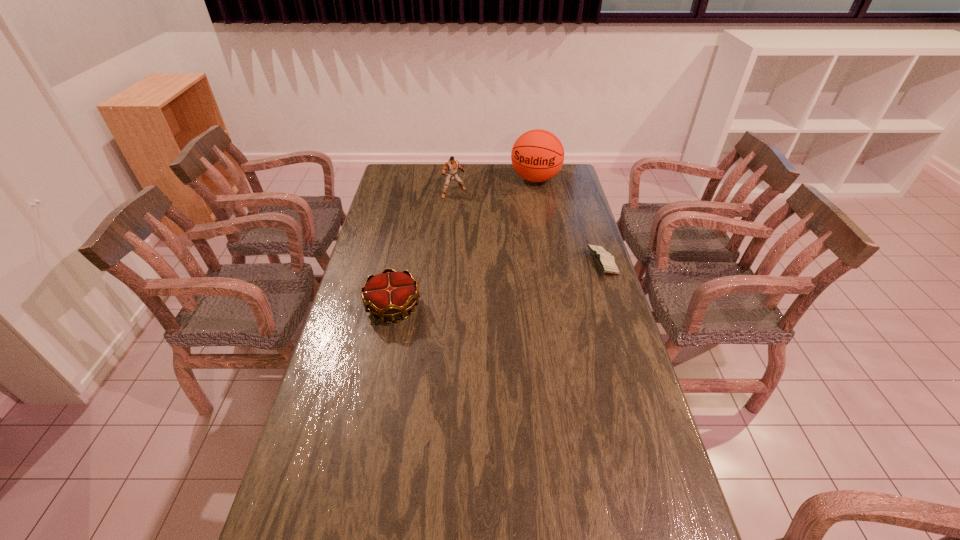
Where is `free space in the image that satisfies the following two spatial constraints: 1. on the back side of the second shortest object; 2. on the right side of the basketball`? This screenshot has height=540, width=960. free space in the image that satisfies the following two spatial constraints: 1. on the back side of the second shortest object; 2. on the right side of the basketball is located at coordinates (419, 179).

Identify the location of free location that satisfies the following two spatial constraints: 1. on the back side of the leftmost object; 2. on the left side of the second tallest object. Image resolution: width=960 pixels, height=540 pixels. (417, 193).

At what (x,y) coordinates should I click in order to perform the action: click on free location that satisfies the following two spatial constraints: 1. on the back side of the third shortest object; 2. on the left side of the second shortest object. Please return your answer as a coordinate pair (x, y). The height and width of the screenshot is (540, 960). Looking at the image, I should click on (417, 193).

Find the location of a particular element. This screenshot has width=960, height=540. vacant area in the image that satisfies the following two spatial constraints: 1. on the front side of the shortest object; 2. on the left side of the third object from right to left is located at coordinates (448, 262).